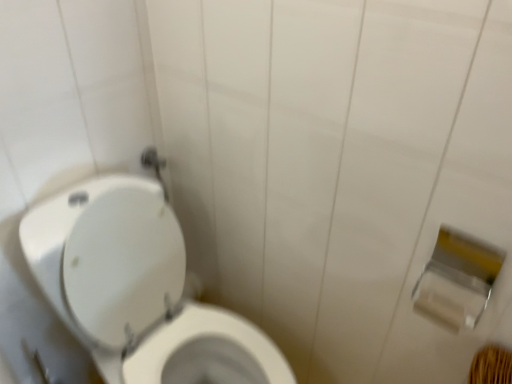
The height and width of the screenshot is (384, 512). What do you see at coordinates (440, 310) in the screenshot?
I see `white matte toilet paper at right, positioned as the 2th toilet paper in top-to-bottom order` at bounding box center [440, 310].

In order to face white glossy toilet at left, should I rotate leftwards or rightwards?

Turn left approximately 10.681 degrees to face it.

Locate an element on the screen. This screenshot has width=512, height=384. silver metallic toilet paper at right, the second toilet paper ordered from the bottom is located at coordinates (457, 279).

At what (x,y) coordinates should I click in order to perform the action: click on white matte toilet paper at right, positioned as the 1th toilet paper in bottom-to-top order. Please return your answer as a coordinate pair (x, y). The height and width of the screenshot is (384, 512). Looking at the image, I should click on (440, 310).

Can you confirm if white matte toilet paper at right, positioned as the 2th toilet paper in top-to-bottom order, is shorter than white glossy toilet at left?

Yes.

Considering the positions of objects white matte toilet paper at right, positioned as the 2th toilet paper in top-to-bottom order, and white glossy toilet at left in the image provided, who is behind, white matte toilet paper at right, positioned as the 2th toilet paper in top-to-bottom order, or white glossy toilet at left?

white matte toilet paper at right, positioned as the 2th toilet paper in top-to-bottom order, is further from the camera.

How many degrees apart are the facing directions of white matte toilet paper at right, positioned as the 1th toilet paper in bottom-to-top order, and white glossy toilet at left?

89.6 degrees.

Based on their positions, is white matte toilet paper at right, positioned as the 2th toilet paper in top-to-bottom order, located to the left or right of white glossy toilet at left?

white matte toilet paper at right, positioned as the 2th toilet paper in top-to-bottom order, is positioned on white glossy toilet at left's right side.

Can you tell me how much silver metallic toilet paper at right, the second toilet paper ordered from the bottom, and white glossy toilet at left differ in facing direction?

The angular difference between silver metallic toilet paper at right, the second toilet paper ordered from the bottom, and white glossy toilet at left is 89.6 degrees.

Is silver metallic toilet paper at right, the second toilet paper ordered from the bottom, at the left side of white glossy toilet at left?

No, silver metallic toilet paper at right, the second toilet paper ordered from the bottom, is not to the left of white glossy toilet at left.

Between silver metallic toilet paper at right, the second toilet paper ordered from the bottom, and white glossy toilet at left, which one has less height?

silver metallic toilet paper at right, the second toilet paper ordered from the bottom.

Is silver metallic toilet paper at right, the second toilet paper ordered from the bottom, further to camera compared to white glossy toilet at left?

That is True.

Image resolution: width=512 pixels, height=384 pixels. Identify the location of toilet paper that is the 1st one when counting backward from the white glossy toilet at left. (457, 279).

Who is shorter, white glossy toilet at left or silver metallic toilet paper at right, arranged as the first toilet paper when viewed from the top?

Standing shorter between the two is silver metallic toilet paper at right, arranged as the first toilet paper when viewed from the top.

Would you consider white glossy toilet at left to be distant from silver metallic toilet paper at right, the second toilet paper ordered from the bottom?

white glossy toilet at left is actually quite close to silver metallic toilet paper at right, the second toilet paper ordered from the bottom.

Which object is more forward, white glossy toilet at left or silver metallic toilet paper at right, the second toilet paper ordered from the bottom?

white glossy toilet at left.

Is white matte toilet paper at right, positioned as the 1th toilet paper in bottom-to-top order, surrounded by silver metallic toilet paper at right, the second toilet paper ordered from the bottom?

Yes, silver metallic toilet paper at right, the second toilet paper ordered from the bottom, contains white matte toilet paper at right, positioned as the 1th toilet paper in bottom-to-top order.

From the image's perspective, which one is positioned higher, silver metallic toilet paper at right, arranged as the first toilet paper when viewed from the top, or white matte toilet paper at right, positioned as the 2th toilet paper in top-to-bottom order?

silver metallic toilet paper at right, arranged as the first toilet paper when viewed from the top, from the image's perspective.

Is silver metallic toilet paper at right, arranged as the first toilet paper when viewed from the top, further to the viewer compared to white matte toilet paper at right, positioned as the 1th toilet paper in bottom-to-top order?

No, silver metallic toilet paper at right, arranged as the first toilet paper when viewed from the top, is closer to the camera.

Considering the relative positions of white glossy toilet at left and white matte toilet paper at right, positioned as the 2th toilet paper in top-to-bottom order, in the image provided, is white glossy toilet at left to the left of white matte toilet paper at right, positioned as the 2th toilet paper in top-to-bottom order, from the viewer's perspective?

Indeed, white glossy toilet at left is positioned on the left side of white matte toilet paper at right, positioned as the 2th toilet paper in top-to-bottom order.

Does white glossy toilet at left turn towards white matte toilet paper at right, positioned as the 1th toilet paper in bottom-to-top order?

No, white glossy toilet at left does not turn towards white matte toilet paper at right, positioned as the 1th toilet paper in bottom-to-top order.

Identify the location of the 1st toilet paper to the right when counting from the white glossy toilet at left. This screenshot has width=512, height=384. (440, 310).

Considering the sizes of objects white glossy toilet at left and white matte toilet paper at right, positioned as the 2th toilet paper in top-to-bottom order, in the image provided, who is bigger, white glossy toilet at left or white matte toilet paper at right, positioned as the 2th toilet paper in top-to-bottom order,?

white glossy toilet at left is bigger.

Is white matte toilet paper at right, positioned as the 1th toilet paper in bottom-to-top order, beside silver metallic toilet paper at right, arranged as the first toilet paper when viewed from the top?

Yes, white matte toilet paper at right, positioned as the 1th toilet paper in bottom-to-top order, is touching silver metallic toilet paper at right, arranged as the first toilet paper when viewed from the top.

From a real-world perspective, is white matte toilet paper at right, positioned as the 2th toilet paper in top-to-bottom order, above or below silver metallic toilet paper at right, arranged as the first toilet paper when viewed from the top?

white matte toilet paper at right, positioned as the 2th toilet paper in top-to-bottom order, is below silver metallic toilet paper at right, arranged as the first toilet paper when viewed from the top.

Is white matte toilet paper at right, positioned as the 2th toilet paper in top-to-bottom order, at the right side of silver metallic toilet paper at right, the second toilet paper ordered from the bottom?

In fact, white matte toilet paper at right, positioned as the 2th toilet paper in top-to-bottom order, is to the left of silver metallic toilet paper at right, the second toilet paper ordered from the bottom.

In the image, is white matte toilet paper at right, positioned as the 2th toilet paper in top-to-bottom order, positioned in front of or behind silver metallic toilet paper at right, the second toilet paper ordered from the bottom?

white matte toilet paper at right, positioned as the 2th toilet paper in top-to-bottom order, is positioned farther from the viewer than silver metallic toilet paper at right, the second toilet paper ordered from the bottom.

Identify the location of toilet paper that is the 1st object above the white glossy toilet at left (from a real-world perspective). The image size is (512, 384). (440, 310).

Where is `toilet that is below the silver metallic toilet paper at right, the second toilet paper ordered from the bottom (from the image's perspective)`? This screenshot has width=512, height=384. toilet that is below the silver metallic toilet paper at right, the second toilet paper ordered from the bottom (from the image's perspective) is located at coordinates (137, 289).

Considering their positions, is white matte toilet paper at right, positioned as the 1th toilet paper in bottom-to-top order, positioned further to silver metallic toilet paper at right, arranged as the first toilet paper when viewed from the top, than white glossy toilet at left?

white glossy toilet at left is positioned further to the anchor silver metallic toilet paper at right, arranged as the first toilet paper when viewed from the top.

From the picture: Considering their positions, is white matte toilet paper at right, positioned as the 2th toilet paper in top-to-bottom order, positioned further to white glossy toilet at left than silver metallic toilet paper at right, the second toilet paper ordered from the bottom?

white matte toilet paper at right, positioned as the 2th toilet paper in top-to-bottom order, is further to white glossy toilet at left.

From the picture: Which object lies further to the anchor point white glossy toilet at left, silver metallic toilet paper at right, the second toilet paper ordered from the bottom, or white matte toilet paper at right, positioned as the 1th toilet paper in bottom-to-top order?

white matte toilet paper at right, positioned as the 1th toilet paper in bottom-to-top order, is positioned further to the anchor white glossy toilet at left.

Estimate the real-world distances between objects in this image. Which object is closer to silver metallic toilet paper at right, arranged as the first toilet paper when viewed from the top, white glossy toilet at left or white matte toilet paper at right, positioned as the 1th toilet paper in bottom-to-top order?

white matte toilet paper at right, positioned as the 1th toilet paper in bottom-to-top order.

Considering their positions, is silver metallic toilet paper at right, arranged as the first toilet paper when viewed from the top, positioned closer to white matte toilet paper at right, positioned as the 1th toilet paper in bottom-to-top order, than white glossy toilet at left?

Among the two, silver metallic toilet paper at right, arranged as the first toilet paper when viewed from the top, is located nearer to white matte toilet paper at right, positioned as the 1th toilet paper in bottom-to-top order.

From the image, which object appears to be farther from white matte toilet paper at right, positioned as the 2th toilet paper in top-to-bottom order, white glossy toilet at left or silver metallic toilet paper at right, arranged as the first toilet paper when viewed from the top?

white glossy toilet at left is further to white matte toilet paper at right, positioned as the 2th toilet paper in top-to-bottom order.

Identify the location of toilet paper situated between white glossy toilet at left and silver metallic toilet paper at right, arranged as the first toilet paper when viewed from the top, from left to right. This screenshot has width=512, height=384. pyautogui.click(x=440, y=310).